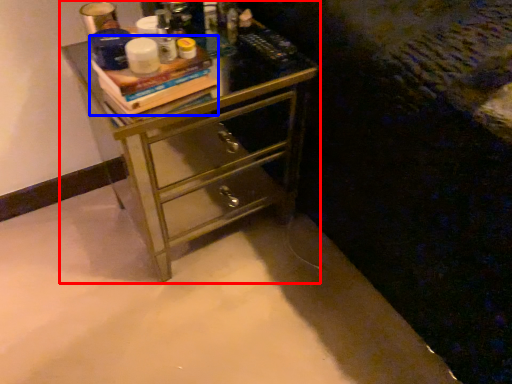
Question: Among these objects, which one is nearest to the camera, chest of drawers (highlighted by a red box) or book (highlighted by a blue box)?

Choices:
 (A) chest of drawers
 (B) book

Answer: (B)